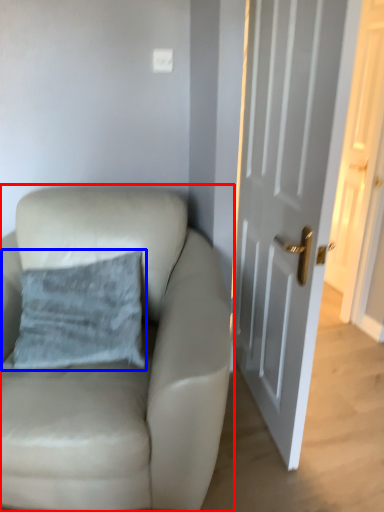
Question: Among these objects, which one is farthest to the camera, chair (highlighted by a red box) or pillow (highlighted by a blue box)?

Choices:
 (A) chair
 (B) pillow

Answer: (B)